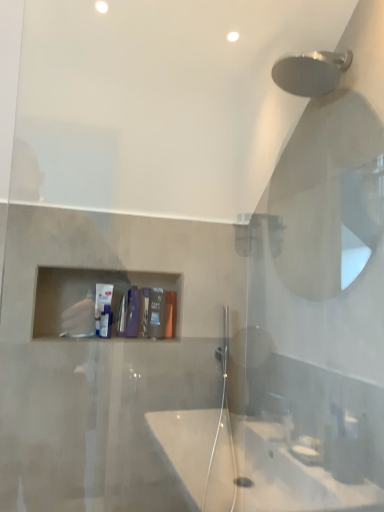
Question: In which direction should I rotate to look at white matte tube at center, which is the 1th toiletry from left to right?

Choices:
 (A) left
 (B) right

Answer: (A)

Question: Is white matte tube at center, which is the 1th toiletry from left to right, bigger than matte plastic container at center, the first toiletry from the right?

Choices:
 (A) yes
 (B) no

Answer: (A)

Question: From a real-world perspective, is white matte tube at center, positioned as the 3th toiletry in right-to-left order, over matte plastic container at center, the first toiletry from the right?

Choices:
 (A) yes
 (B) no

Answer: (A)

Question: Does white matte tube at center, positioned as the 3th toiletry in right-to-left order, come behind matte plastic container at center, the first toiletry from the right?

Choices:
 (A) yes
 (B) no

Answer: (B)

Question: Is white matte tube at center, positioned as the 3th toiletry in right-to-left order, positioned beyond the bounds of matte plastic container at center, marked as the 3th toiletry in a left-to-right arrangement?

Choices:
 (A) yes
 (B) no

Answer: (A)

Question: Is white matte tube at center, positioned as the 3th toiletry in right-to-left order, shorter than matte plastic container at center, marked as the 3th toiletry in a left-to-right arrangement?

Choices:
 (A) yes
 (B) no

Answer: (B)

Question: Is white matte tube at center, positioned as the 3th toiletry in right-to-left order, looking in the opposite direction of matte plastic container at center, the first toiletry from the right?

Choices:
 (A) no
 (B) yes

Answer: (A)

Question: Is white matte tube at center, positioned as the 3th toiletry in right-to-left order, looking in the opposite direction of matte black soap at center, which is the 2th toiletry from left to right?

Choices:
 (A) no
 (B) yes

Answer: (A)

Question: Considering the relative positions of white matte tube at center, positioned as the 3th toiletry in right-to-left order, and matte black soap at center, acting as the 2th toiletry starting from the right, in the image provided, is white matte tube at center, positioned as the 3th toiletry in right-to-left order, in front of matte black soap at center, acting as the 2th toiletry starting from the right,?

Choices:
 (A) yes
 (B) no

Answer: (B)

Question: From the image's perspective, is white matte tube at center, which is the 1th toiletry from left to right, over matte black soap at center, acting as the 2th toiletry starting from the right?

Choices:
 (A) no
 (B) yes

Answer: (B)

Question: Would you consider white matte tube at center, which is the 1th toiletry from left to right, to be distant from matte black soap at center, which is the 2th toiletry from left to right?

Choices:
 (A) no
 (B) yes

Answer: (A)

Question: From the image's perspective, is white matte tube at center, positioned as the 3th toiletry in right-to-left order, under matte black soap at center, which is the 2th toiletry from left to right?

Choices:
 (A) no
 (B) yes

Answer: (A)

Question: Considering the relative sizes of white matte tube at center, positioned as the 3th toiletry in right-to-left order, and matte black soap at center, which is the 2th toiletry from left to right, in the image provided, is white matte tube at center, positioned as the 3th toiletry in right-to-left order, bigger than matte black soap at center, which is the 2th toiletry from left to right,?

Choices:
 (A) yes
 (B) no

Answer: (A)

Question: From the image's perspective, would you say matte plastic container at center, the first toiletry from the right, is positioned over white matte tube at center, positioned as the 3th toiletry in right-to-left order?

Choices:
 (A) yes
 (B) no

Answer: (B)